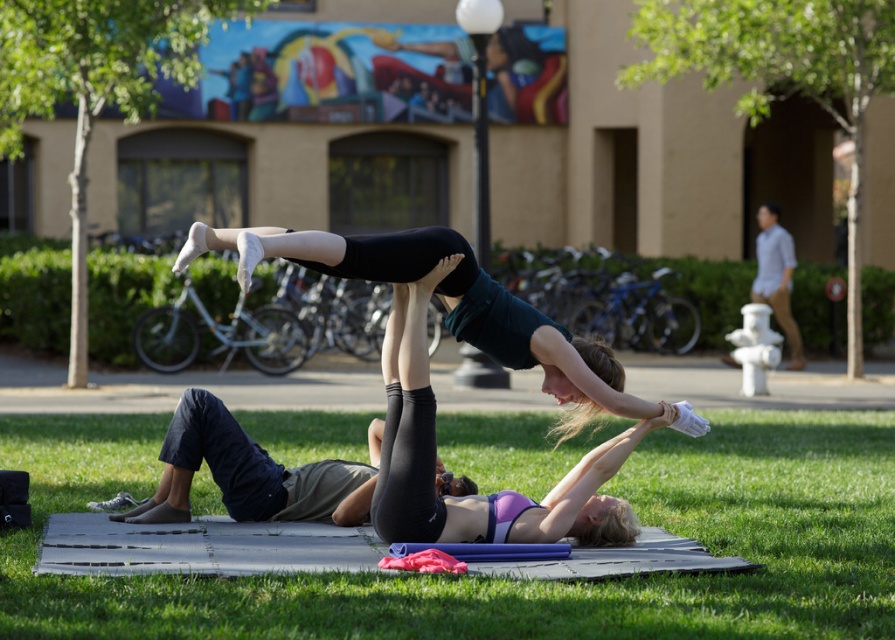
Question: Which object is farther from the camera taking this photo?

Choices:
 (A) black matte yoga pose at center
 (B) green grass at lower center

Answer: (A)

Question: Is green grass at lower center closer to the viewer compared to matte black leggings at center?

Choices:
 (A) no
 (B) yes

Answer: (B)

Question: Does matte black leggings at center have a lesser width compared to black matte yoga pose at center?

Choices:
 (A) yes
 (B) no

Answer: (A)

Question: Does green grass at lower center have a larger size compared to matte black leggings at center?

Choices:
 (A) yes
 (B) no

Answer: (A)

Question: Which of the following is the farthest from the observer?

Choices:
 (A) (223, 236)
 (B) (423, 440)
 (C) (32, 593)

Answer: (B)

Question: Which object is positioned closest to the black matte yoga pose at center?

Choices:
 (A) green grass at lower center
 (B) matte black leggings at center

Answer: (B)